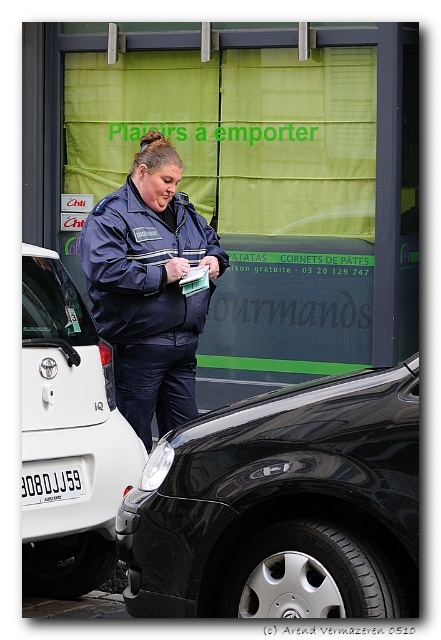
You are a delivery driver who needs to check the license plate of the car next to the woman in the matte blue uniform at center. Can you reach the white plastic license plate at center from your current position without moving more than 4 feet?

The matte blue uniform at center is 4.27 feet from the white plastic license plate at center. Since the distance is slightly more than 4 feet, you cannot reach the white plastic license plate at center without moving more than 4 feet.

In the scene shown: You are a delivery driver who needs to park your vehicle in this urban area. There is a white matte car at left. Based on its position, can you estimate where you should park your car to avoid blocking the storefront with the green tarpaulin?

The white matte car at left is located at point (67, 436), so you should park your car to the right of it to avoid blocking the storefront with the green tarpaulin.

You are a delivery driver who needs to park your vehicle near the storefront with the green tarpaulin. You see the matte blue uniform at center and the white plastic license plate at center. Which object should you check to ensure proper parking authorization?

The white plastic license plate at center should be checked for proper parking authorization because it is smaller and likely part of the vehicle, whereas the matte blue uniform at center is larger and likely worn by the person issuing a ticket.